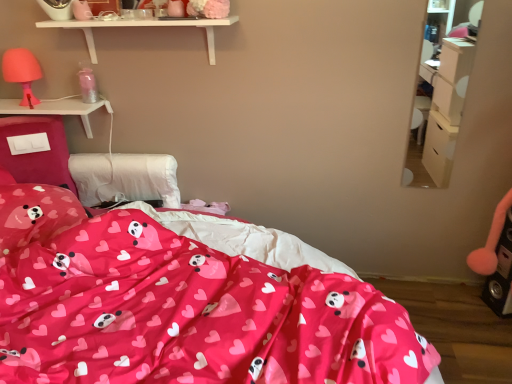
This screenshot has height=384, width=512. Describe the element at coordinates (22, 72) in the screenshot. I see `matte pink lampshade at left` at that location.

Where is `wooden dresser at right`? This screenshot has width=512, height=384. wooden dresser at right is located at coordinates (441, 91).

Describe the element at coordinates (178, 307) in the screenshot. I see `matte pink fabric bed at center` at that location.

Find the location of a particular element. This screenshot has height=384, width=512. white plastic switch at left is located at coordinates (57, 109).

From the picture: Does matte pink pillow with heart and panda prints at lower left touch matte pink fabric bed at center?

No, matte pink pillow with heart and panda prints at lower left is not touching matte pink fabric bed at center.

Looking at their sizes, would you say matte pink pillow with heart and panda prints at lower left is wider or thinner than matte pink fabric bed at center?

Considering their sizes, matte pink pillow with heart and panda prints at lower left looks slimmer than matte pink fabric bed at center.

Who is shorter, matte pink pillow with heart and panda prints at lower left or matte pink fabric bed at center?

With less height is matte pink pillow with heart and panda prints at lower left.

From a real-world perspective, is matte pink pillow with heart and panda prints at lower left on top of matte pink fabric bed at center?

Incorrect, from a real-world perspective, matte pink pillow with heart and panda prints at lower left is lower than matte pink fabric bed at center.

From a real-world perspective, between white plastic switch at left and matte pink pillow with heart and panda prints at lower left, who is vertically lower?

matte pink pillow with heart and panda prints at lower left is physically lower.

Is white plastic switch at left facing towards matte pink pillow with heart and panda prints at lower left?

No, white plastic switch at left is not turned towards matte pink pillow with heart and panda prints at lower left.

Is white plastic switch at left next to matte pink pillow with heart and panda prints at lower left?

white plastic switch at left and matte pink pillow with heart and panda prints at lower left are clearly separated.

Looking at this image, how much distance is there between white matte shelf at upper center and white plastic switch at left?

35.21 centimeters.

Is point (208, 51) closer to viewer compared to point (88, 123)?

Yes, it is in front of point (88, 123).

From a real-world perspective, which is physically above, white matte shelf at upper center or white plastic switch at left?

From a 3D spatial view, white matte shelf at upper center is above.

Is matte pink pillow with heart and panda prints at lower left facing towards white matte shelf at upper center?

No, matte pink pillow with heart and panda prints at lower left is not turned towards white matte shelf at upper center.

Could you measure the distance between matte pink pillow with heart and panda prints at lower left and white matte shelf at upper center?

The distance of matte pink pillow with heart and panda prints at lower left from white matte shelf at upper center is 29.58 inches.

Is point (69, 222) positioned in front of point (123, 26)?

That is True.

Is white plastic switch at left far from matte pink lampshade at left?

No, white plastic switch at left is in close proximity to matte pink lampshade at left.

Considering the relative sizes of white plastic switch at left and matte pink lampshade at left in the image provided, is white plastic switch at left wider than matte pink lampshade at left?

Correct, the width of white plastic switch at left exceeds that of matte pink lampshade at left.

Does point (82, 112) come closer to viewer compared to point (34, 75)?

No, it is not.

Is point (155, 21) positioned in front of point (155, 335)?

No, it is behind (155, 335).

Image resolution: width=512 pixels, height=384 pixels. Find the location of `bed that appears below the white matte shelf at upper center (from the image's perspective)`. bed that appears below the white matte shelf at upper center (from the image's perspective) is located at coordinates (178, 307).

From the image's perspective, is white matte shelf at upper center over matte pink fabric bed at center?

Yes, from the image's perspective, white matte shelf at upper center is above matte pink fabric bed at center.

Looking at this image, is white plastic switch at left located within matte pink pillow with heart and panda prints at lower left?

Definitely not — white plastic switch at left is not inside matte pink pillow with heart and panda prints at lower left.

How far apart are matte pink pillow with heart and panda prints at lower left and white plastic switch at left?

They are 17.81 inches apart.

Is white plastic switch at left at the back of matte pink pillow with heart and panda prints at lower left?

No, white plastic switch at left is not at the back of matte pink pillow with heart and panda prints at lower left.

Which is closer to the camera, (19, 206) or (64, 99)?

Point (19, 206) is closer to the camera than point (64, 99).

Find the location of `pillow directly beneath the matte pink fabric bed at center (from a real-world perspective)`. pillow directly beneath the matte pink fabric bed at center (from a real-world perspective) is located at coordinates (35, 214).

What are the coordinates of `pillow lying on the right of white plastic switch at left` in the screenshot? It's located at (35, 214).

Based on their spatial positions, is wooden dresser at right or matte pink pillow with heart and panda prints at lower left closer to matte pink fabric bed at center?

matte pink pillow with heart and panda prints at lower left lies closer to matte pink fabric bed at center than the other object.

When comparing their distances from white matte shelf at upper center, does matte pink fabric bed at center or matte pink lampshade at left seem closer?

matte pink lampshade at left lies closer to white matte shelf at upper center than the other object.

Estimate the real-world distances between objects in this image. Which object is further from white plastic switch at left, white matte shelf at upper center or matte pink fabric bed at center?

matte pink fabric bed at center is positioned further to the anchor white plastic switch at left.

Estimate the real-world distances between objects in this image. Which object is closer to wooden dresser at right, white matte shelf at upper center or matte pink lampshade at left?

Among the two, white matte shelf at upper center is located nearer to wooden dresser at right.

Looking at the image, which one is located further to matte pink pillow with heart and panda prints at lower left, wooden dresser at right or matte pink lampshade at left?

wooden dresser at right is positioned further to the anchor matte pink pillow with heart and panda prints at lower left.

Based on their spatial positions, is matte pink pillow with heart and panda prints at lower left or wooden dresser at right closer to white matte shelf at upper center?

Among the two, matte pink pillow with heart and panda prints at lower left is located nearer to white matte shelf at upper center.

Based on their spatial positions, is matte pink fabric bed at center or white matte shelf at upper center further from matte pink pillow with heart and panda prints at lower left?

white matte shelf at upper center is positioned further to the anchor matte pink pillow with heart and panda prints at lower left.

Considering their positions, is wooden dresser at right positioned closer to matte pink lampshade at left than matte pink pillow with heart and panda prints at lower left?

matte pink pillow with heart and panda prints at lower left.

Find the location of a particular element. pillow between white plastic switch at left and wooden dresser at right in the horizontal direction is located at coordinates (35, 214).

The image size is (512, 384). What are the coordinates of `shelf located between white plastic switch at left and wooden dresser at right in the left-right direction` in the screenshot? It's located at (142, 26).

The width and height of the screenshot is (512, 384). Find the location of `desk between matte pink lampshade at left and white matte shelf at upper center from left to right`. desk between matte pink lampshade at left and white matte shelf at upper center from left to right is located at coordinates [57, 109].

This screenshot has width=512, height=384. Find the location of `pillow between matte pink fabric bed at center and white plastic switch at left from front to back`. pillow between matte pink fabric bed at center and white plastic switch at left from front to back is located at coordinates (35, 214).